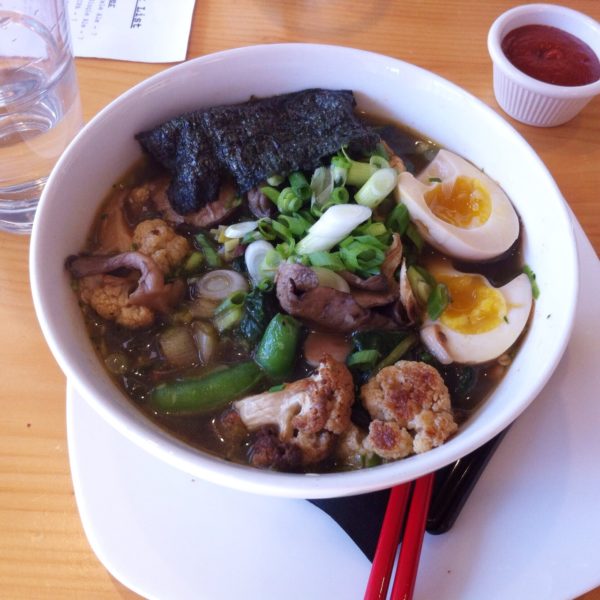
Image resolution: width=600 pixels, height=600 pixels. Find the location of `chopsticks`. chopsticks is located at coordinates (414, 544), (388, 541).